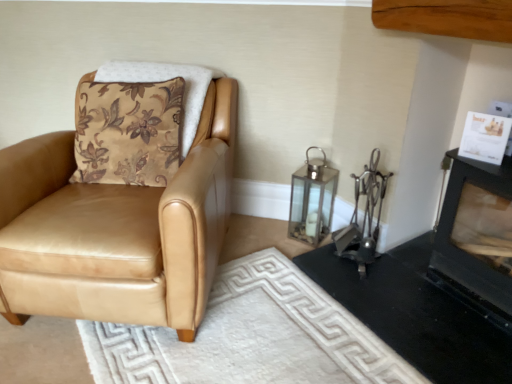
In order to face tan leather chair at left, should I rotate leftwards or rightwards?

It's best to rotate left around 16.604 degrees.

This screenshot has width=512, height=384. What are the coordinates of `black matte fireplace at upper right, acting as the 1th fireplace starting from the top` in the screenshot? It's located at (476, 238).

Locate an element on the screen. black matte fireplace at lower right, which ranks as the 2th fireplace in top-to-bottom order is located at coordinates (439, 284).

Is tan leather chair at left directly adjacent to black matte fireplace at upper right, acting as the 1th fireplace starting from the top?

tan leather chair at left and black matte fireplace at upper right, acting as the 1th fireplace starting from the top, are clearly separated.

Considering the sizes of objects tan leather chair at left and black matte fireplace at upper right, acting as the 1th fireplace starting from the top, in the image provided, who is smaller, tan leather chair at left or black matte fireplace at upper right, acting as the 1th fireplace starting from the top,?

black matte fireplace at upper right, acting as the 1th fireplace starting from the top, is smaller.

Which point is more distant from viewer, (12, 166) or (456, 255)?

The point (456, 255) is behind.

From the image's perspective, which is above, tan leather chair at left or black matte fireplace at upper right, acting as the 1th fireplace starting from the top?

tan leather chair at left, from the image's perspective.

From a real-world perspective, which is physically above, white textured rug at lower center or black matte fireplace at lower right, which is the 1th fireplace from bottom to top?

black matte fireplace at lower right, which is the 1th fireplace from bottom to top, from a real-world perspective.

From the image's perspective, is white textured rug at lower center positioned above or below black matte fireplace at lower right, which is the 1th fireplace from bottom to top?

white textured rug at lower center is below black matte fireplace at lower right, which is the 1th fireplace from bottom to top.

Can you confirm if white textured rug at lower center is thinner than black matte fireplace at lower right, which is the 1th fireplace from bottom to top?

No, white textured rug at lower center is not thinner than black matte fireplace at lower right, which is the 1th fireplace from bottom to top.

Is black matte fireplace at lower right, which ranks as the 2th fireplace in top-to-bottom order, facing towards black matte fireplace at upper right, acting as the 1th fireplace starting from the top?

No, black matte fireplace at lower right, which ranks as the 2th fireplace in top-to-bottom order, is not facing towards black matte fireplace at upper right, acting as the 1th fireplace starting from the top.

From the image's perspective, is black matte fireplace at lower right, which ranks as the 2th fireplace in top-to-bottom order, on black matte fireplace at upper right, placed as the second fireplace when sorted from bottom to top?

No, from the image's perspective, black matte fireplace at lower right, which ranks as the 2th fireplace in top-to-bottom order, is not above black matte fireplace at upper right, placed as the second fireplace when sorted from bottom to top.

Identify the location of fireplace that appears on the right of black matte fireplace at lower right, which is the 1th fireplace from bottom to top. This screenshot has width=512, height=384. (476, 238).

Measure the distance from black matte fireplace at lower right, which is the 1th fireplace from bottom to top, to black matte fireplace at upper right, acting as the 1th fireplace starting from the top.

A distance of 3.38 inches exists between black matte fireplace at lower right, which is the 1th fireplace from bottom to top, and black matte fireplace at upper right, acting as the 1th fireplace starting from the top.

Is black matte fireplace at upper right, placed as the second fireplace when sorted from bottom to top, in contact with clear glass lantern at center-right?

There is a gap between black matte fireplace at upper right, placed as the second fireplace when sorted from bottom to top, and clear glass lantern at center-right.

Considering the relative sizes of black matte fireplace at upper right, placed as the second fireplace when sorted from bottom to top, and clear glass lantern at center-right in the image provided, is black matte fireplace at upper right, placed as the second fireplace when sorted from bottom to top, smaller than clear glass lantern at center-right?

Actually, black matte fireplace at upper right, placed as the second fireplace when sorted from bottom to top, might be larger than clear glass lantern at center-right.

From a real-world perspective, is black matte fireplace at upper right, acting as the 1th fireplace starting from the top, on clear glass lantern at center-right?

Indeed, from a real-world perspective, black matte fireplace at upper right, acting as the 1th fireplace starting from the top, stands above clear glass lantern at center-right.

Can you tell me how much black matte fireplace at upper right, placed as the second fireplace when sorted from bottom to top, and clear glass lantern at center-right differ in facing direction?

44.4 degrees.

Can you confirm if clear glass lantern at center-right is shorter than white textured rug at lower center?

In fact, clear glass lantern at center-right may be taller than white textured rug at lower center.

Which object is further away from the camera, clear glass lantern at center-right or white textured rug at lower center?

clear glass lantern at center-right is more distant.

From the image's perspective, which one is positioned higher, clear glass lantern at center-right or white textured rug at lower center?

clear glass lantern at center-right is shown above in the image.

Would you consider clear glass lantern at center-right to be distant from white textured rug at lower center?

That's not correct — clear glass lantern at center-right is a little close to white textured rug at lower center.

From the image's perspective, is clear glass lantern at center-right located beneath tan leather chair at left?

Yes, from the image's perspective, clear glass lantern at center-right is beneath tan leather chair at left.

From a real-world perspective, is clear glass lantern at center-right under tan leather chair at left?

Yes, from a real-world perspective, clear glass lantern at center-right is beneath tan leather chair at left.

Can you confirm if clear glass lantern at center-right is positioned to the right of tan leather chair at left?

Yes, clear glass lantern at center-right is to the right of tan leather chair at left.

Would you say white textured rug at lower center is inside or outside tan leather chair at left?

white textured rug at lower center exists outside the volume of tan leather chair at left.

How much distance is there between white textured rug at lower center and tan leather chair at left?

white textured rug at lower center is 37.79 centimeters from tan leather chair at left.

Is white textured rug at lower center not close to tan leather chair at left?

That's not correct — white textured rug at lower center is a little close to tan leather chair at left.

Consider the image. From a real-world perspective, between white textured rug at lower center and tan leather chair at left, who is vertically higher?

tan leather chair at left is physically above.

The width and height of the screenshot is (512, 384). What are the coordinates of `fireplace located in front of the tan leather chair at left` in the screenshot? It's located at [476, 238].

Where is `the 1st fireplace positioned above the white textured rug at lower center (from the image's perspective)`? This screenshot has width=512, height=384. the 1st fireplace positioned above the white textured rug at lower center (from the image's perspective) is located at coordinates (439, 284).

When comparing their distances from tan leather chair at left, does white textured rug at lower center or clear glass lantern at center-right seem closer?

Among the two, white textured rug at lower center is located nearer to tan leather chair at left.

Based on their spatial positions, is clear glass lantern at center-right or tan leather chair at left further from black matte fireplace at lower right, which ranks as the 2th fireplace in top-to-bottom order?

tan leather chair at left.

Looking at the image, which one is located further to black matte fireplace at upper right, placed as the second fireplace when sorted from bottom to top, clear glass lantern at center-right or tan leather chair at left?

tan leather chair at left lies further to black matte fireplace at upper right, placed as the second fireplace when sorted from bottom to top, than the other object.

From the image, which object appears to be nearer to white textured rug at lower center, clear glass lantern at center-right or tan leather chair at left?

Based on the image, tan leather chair at left appears to be nearer to white textured rug at lower center.

Looking at the image, which one is located further to tan leather chair at left, black matte fireplace at lower right, which ranks as the 2th fireplace in top-to-bottom order, or white textured rug at lower center?

Based on the image, black matte fireplace at lower right, which ranks as the 2th fireplace in top-to-bottom order, appears to be further to tan leather chair at left.

When comparing their distances from black matte fireplace at lower right, which is the 1th fireplace from bottom to top, does tan leather chair at left or white textured rug at lower center seem further?

tan leather chair at left lies further to black matte fireplace at lower right, which is the 1th fireplace from bottom to top, than the other object.

Based on their spatial positions, is black matte fireplace at upper right, placed as the second fireplace when sorted from bottom to top, or black matte fireplace at lower right, which ranks as the 2th fireplace in top-to-bottom order, further from clear glass lantern at center-right?

Based on the image, black matte fireplace at upper right, placed as the second fireplace when sorted from bottom to top, appears to be further to clear glass lantern at center-right.

Considering their positions, is black matte fireplace at lower right, which is the 1th fireplace from bottom to top, positioned closer to clear glass lantern at center-right than tan leather chair at left?

Based on the image, black matte fireplace at lower right, which is the 1th fireplace from bottom to top, appears to be nearer to clear glass lantern at center-right.

The image size is (512, 384). Find the location of `lantern between tan leather chair at left and black matte fireplace at lower right, which ranks as the 2th fireplace in top-to-bottom order, in the horizontal direction`. lantern between tan leather chair at left and black matte fireplace at lower right, which ranks as the 2th fireplace in top-to-bottom order, in the horizontal direction is located at coordinates (312, 200).

This screenshot has height=384, width=512. Find the location of `lantern located between tan leather chair at left and black matte fireplace at upper right, placed as the second fireplace when sorted from bottom to top, in the left-right direction`. lantern located between tan leather chair at left and black matte fireplace at upper right, placed as the second fireplace when sorted from bottom to top, in the left-right direction is located at coordinates (312, 200).

Identify the location of mat located between tan leather chair at left and black matte fireplace at upper right, acting as the 1th fireplace starting from the top, in the left-right direction. The width and height of the screenshot is (512, 384). (251, 336).

The height and width of the screenshot is (384, 512). Identify the location of mat between tan leather chair at left and black matte fireplace at lower right, which is the 1th fireplace from bottom to top, from left to right. (251, 336).